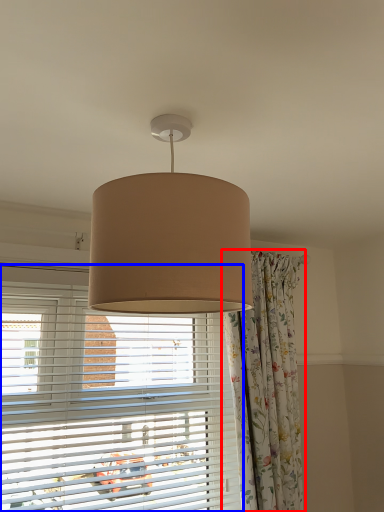
Question: Which object appears closest to the camera in this image, curtain (highlighted by a red box) or window blind (highlighted by a blue box)?

Choices:
 (A) curtain
 (B) window blind

Answer: (B)